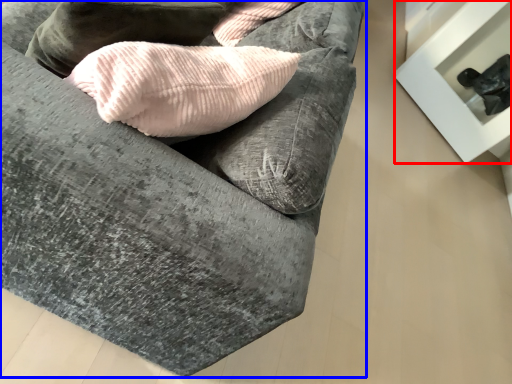
Question: Which of the following is the closest to the observer, furniture (highlighted by a red box) or studio couch (highlighted by a blue box)?

Choices:
 (A) furniture
 (B) studio couch

Answer: (B)